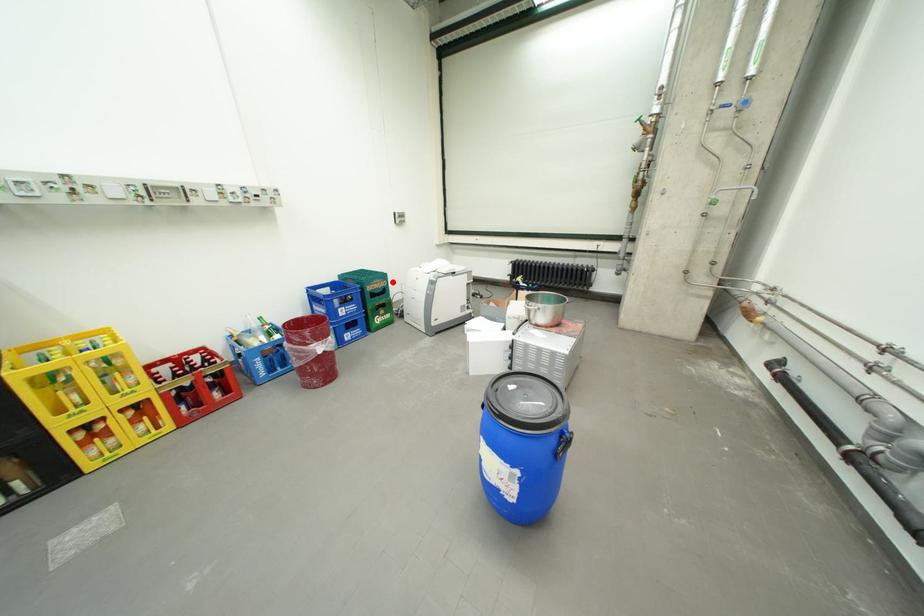
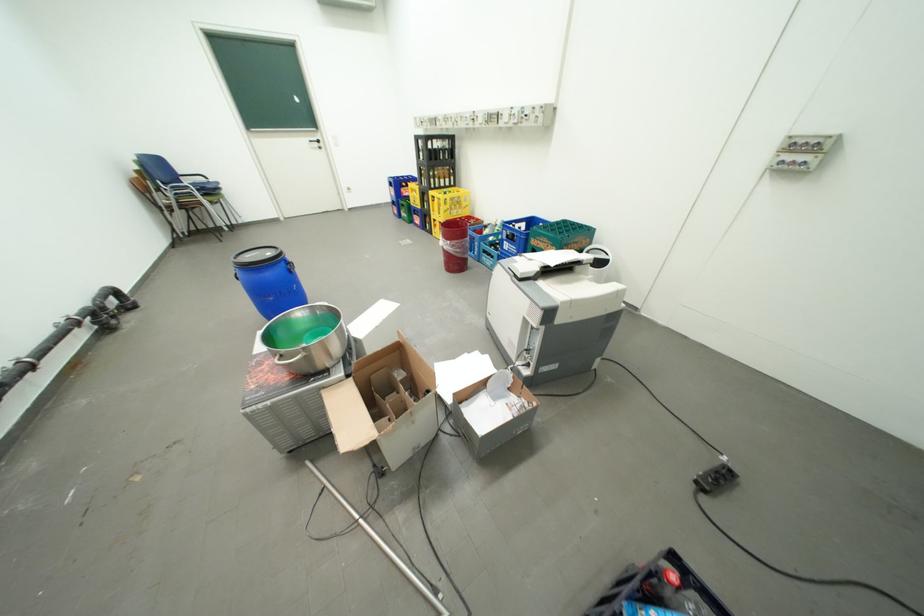
Question: I am providing you with two images of the same scene from different viewpoints. A red point is marked on the first image. At the location where the point appears in image 1, is it still visible in image 2?

Choices:
 (A) Yes
 (B) No

Answer: (A)